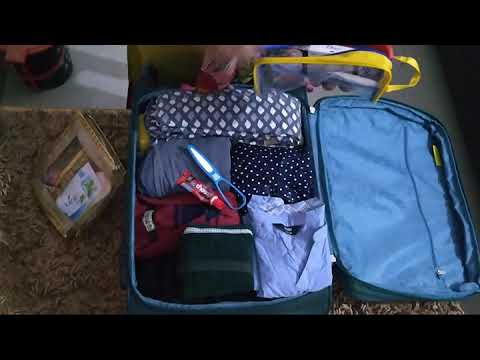
Find the location of a particular element. The width and height of the screenshot is (480, 360). towel is located at coordinates (205, 248).